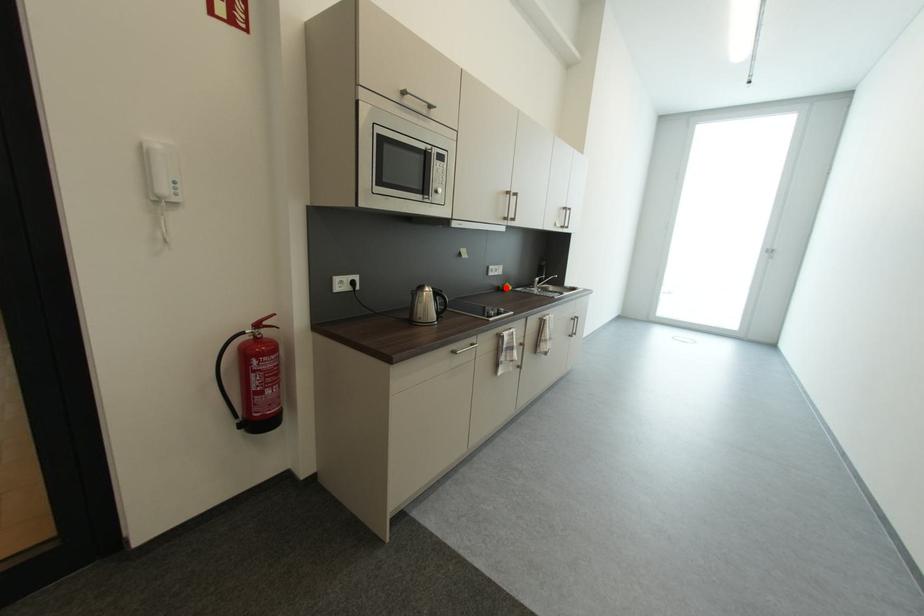
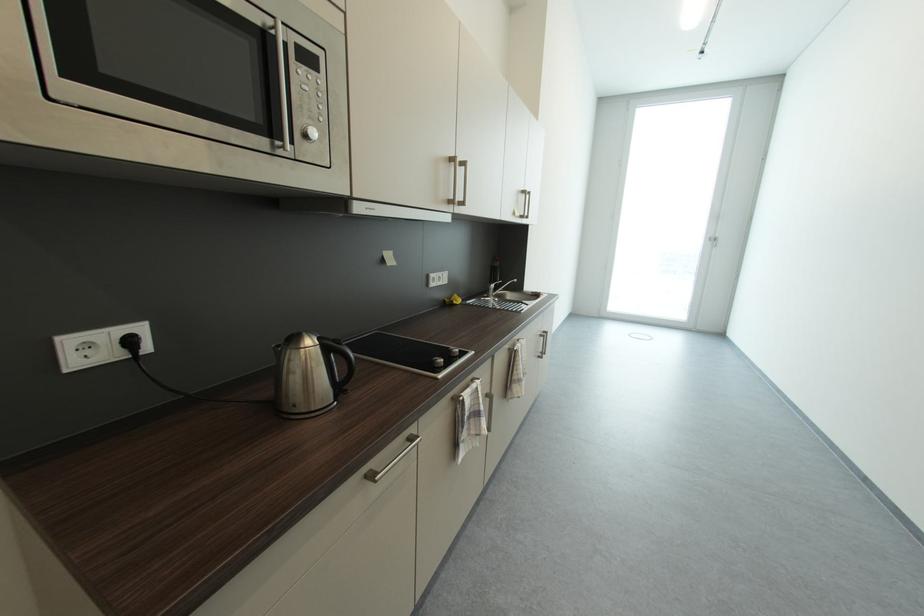
Where in the second image is the point corresponding to the highlighted location from the first image?

(453, 302)